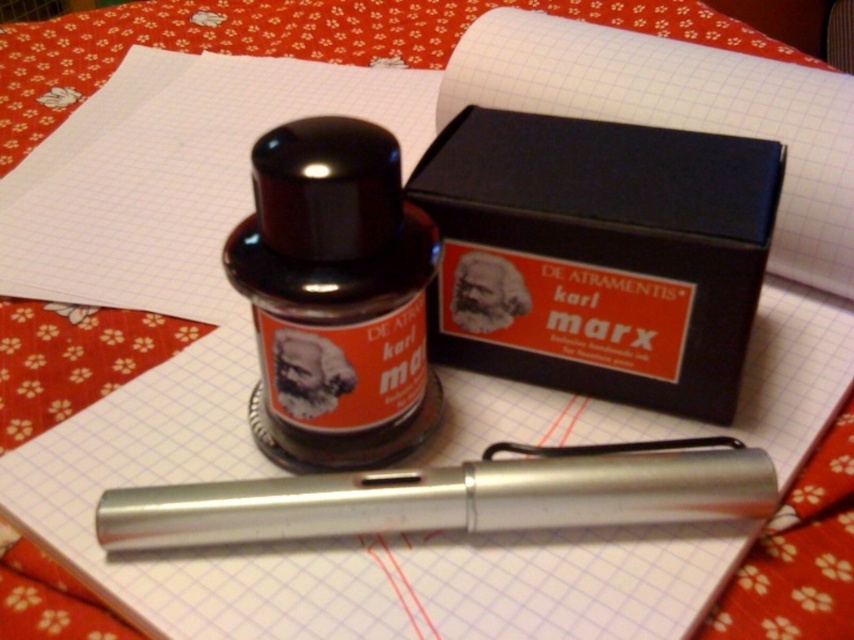
Does black cardboard box at center have a greater height compared to black glass bottle at center?

Yes, black cardboard box at center is taller than black glass bottle at center.

Does black cardboard box at center have a larger size compared to black glass bottle at center?

Incorrect, black cardboard box at center is not larger than black glass bottle at center.

Between point (582, 353) and point (309, 230), which one is positioned behind?

The point (582, 353) is behind.

In order to click on black cardboard box at center in this screenshot , I will do `click(600, 253)`.

Between black glass bottle at center and silver metallic pen at center, which one has more height?

With more height is black glass bottle at center.

Between point (287, 273) and point (461, 480), which one is positioned in front?

Point (287, 273) is more forward.

This screenshot has height=640, width=854. I want to click on black glass bottle at center, so (x=336, y=298).

Can you confirm if black cardboard box at center is bigger than silver metallic pen at center?

Indeed, black cardboard box at center has a larger size compared to silver metallic pen at center.

Is black cardboard box at center taller than silver metallic pen at center?

Yes.

Is point (762, 220) positioned after point (689, 500)?

Yes, point (762, 220) is behind point (689, 500).

Where is `black cardboard box at center`? This screenshot has width=854, height=640. black cardboard box at center is located at coordinates (600, 253).